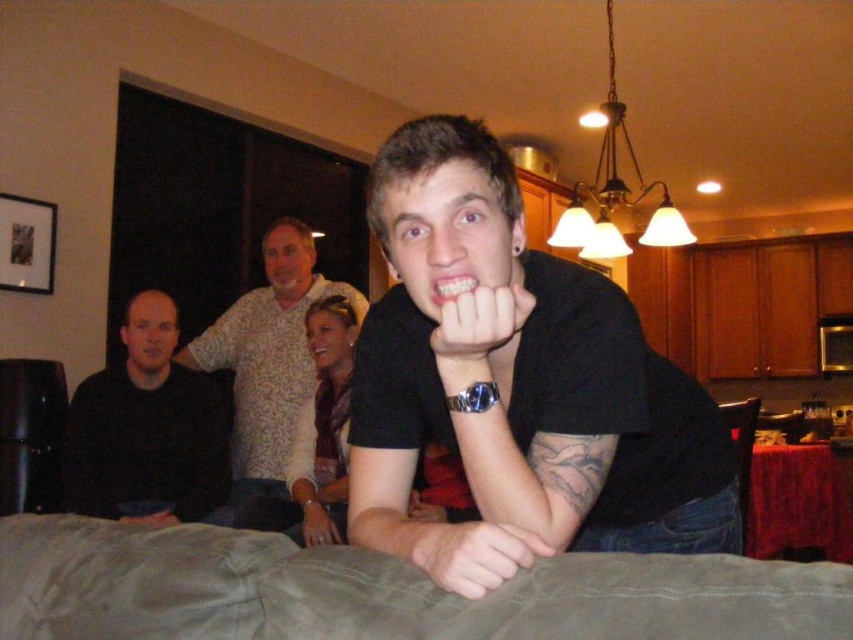
You are a photographer adjusting your camera settings to focus on the white leather bracelet at lower center and the smooth skin hand at lower center. Which object is positioned higher in the frame?

The white leather bracelet at lower center is located above the smooth skin hand at lower center, so it is positioned higher in the frame.